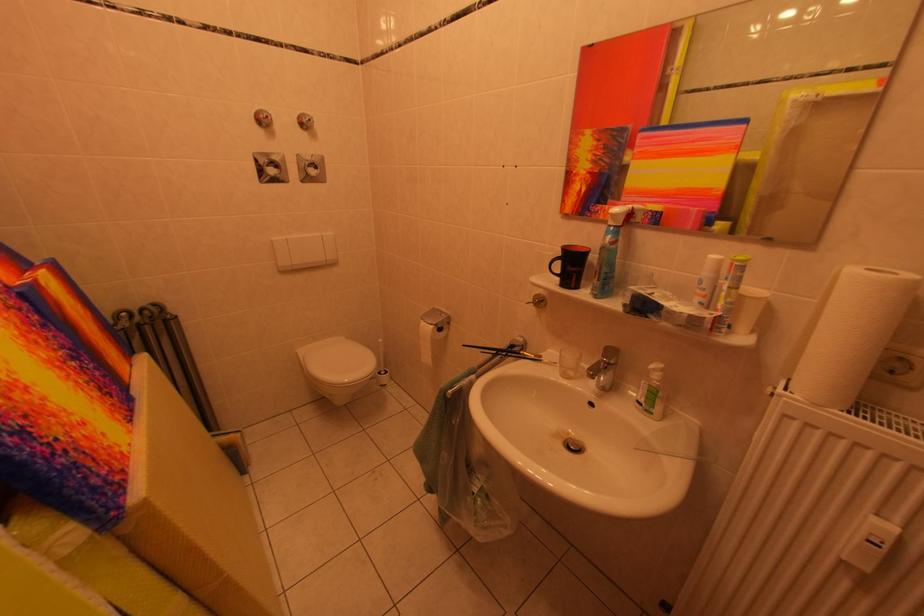
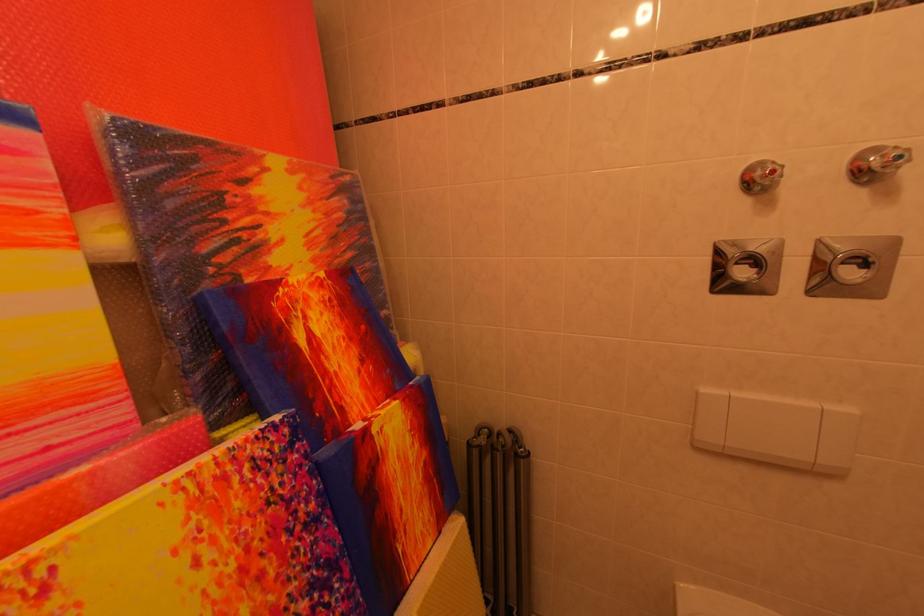
Where in the second image is the point corresponding to pixel 320 123 from the first image?

(907, 161)